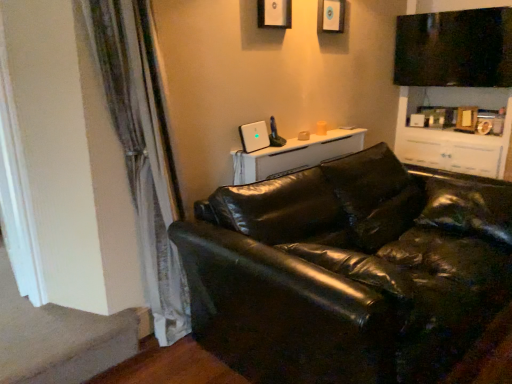
Identify the location of blank space situated above carpet at lower left (from a real-world perspective). The width and height of the screenshot is (512, 384). (39, 329).